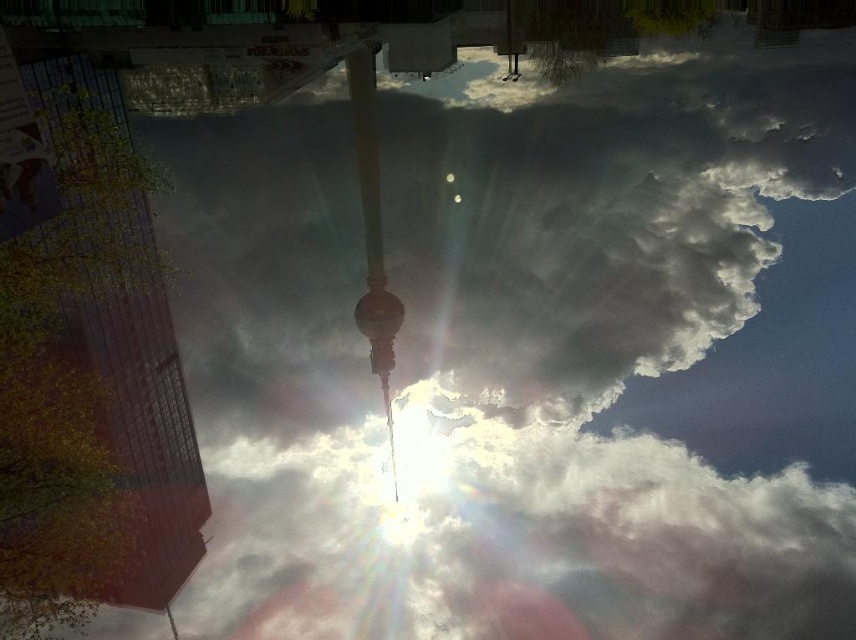
Question: Which of the following is the closest to the observer?

Choices:
 (A) (146, 323)
 (B) (393, 355)

Answer: (A)

Question: Considering the relative positions of glassy reflective tower at left and shiny gold pole at center in the image provided, where is glassy reflective tower at left located with respect to shiny gold pole at center?

Choices:
 (A) right
 (B) left

Answer: (B)

Question: Where is glassy reflective tower at left located in relation to shiny gold pole at center in the image?

Choices:
 (A) below
 (B) above

Answer: (A)

Question: Which point appears farthest from the camera in this image?

Choices:
 (A) (387, 412)
 (B) (144, 600)

Answer: (B)

Question: Is glassy reflective tower at left above shiny gold pole at center?

Choices:
 (A) yes
 (B) no

Answer: (B)

Question: Which object appears closest to the camera in this image?

Choices:
 (A) glassy reflective tower at left
 (B) shiny gold pole at center

Answer: (A)